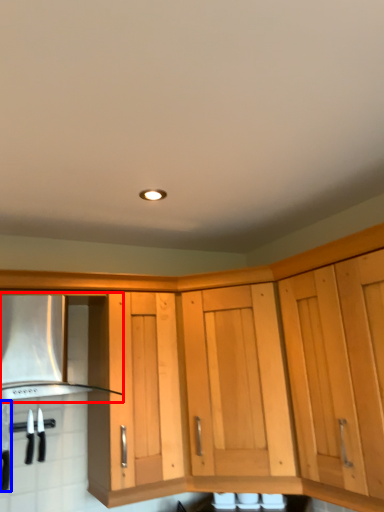
Question: Which object is further to the camera taking this photo, vent (highlighted by a red box) or kitchen appliance (highlighted by a blue box)?

Choices:
 (A) vent
 (B) kitchen appliance

Answer: (B)